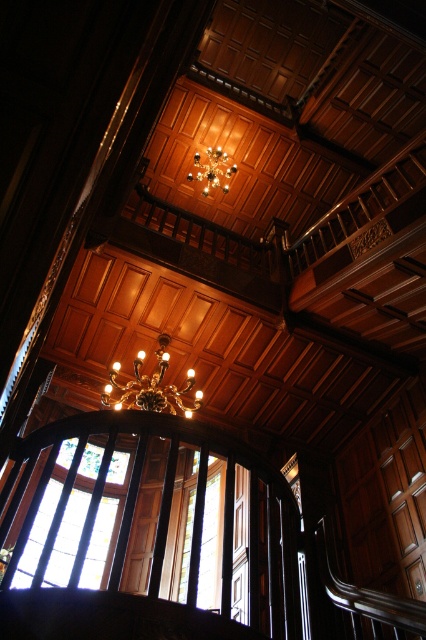
Question: Observing the image, what is the correct spatial positioning of clear glass window at center in reference to gold metallic chandelier at center?

Choices:
 (A) right
 (B) left

Answer: (A)

Question: Can you confirm if clear glass window at center is bigger than gold metallic chandelier at center?

Choices:
 (A) no
 (B) yes

Answer: (B)

Question: Which object is farther from the camera taking this photo?

Choices:
 (A) gold metallic chandelier at upper center
 (B) clear glass window at center

Answer: (A)

Question: Can you confirm if clear glass window at center is smaller than gold metallic chandelier at upper center?

Choices:
 (A) yes
 (B) no

Answer: (B)

Question: Which point appears closest to the camera in this image?

Choices:
 (A) (178, 544)
 (B) (117, 371)

Answer: (A)

Question: Which object is farther from the camera taking this photo?

Choices:
 (A) gold metallic chandelier at center
 (B) gold metallic chandelier at upper center

Answer: (B)